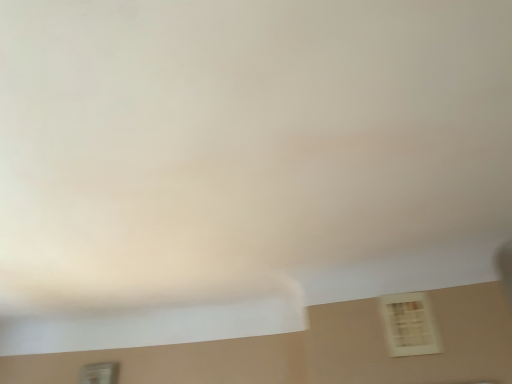
You are a GUI agent. You are given a task and a screenshot of the screen. Output one action in this format:
    pyautogui.click(x=<x>, y=<y>)
    Task: Click on the white plastic window at lower left, the 2th window when ordered from top to bottom
    The height and width of the screenshot is (384, 512).
    Given the screenshot: What is the action you would take?
    pyautogui.click(x=99, y=373)

The height and width of the screenshot is (384, 512). What do you see at coordinates (99, 373) in the screenshot?
I see `white plastic window at lower left, positioned as the first window in bottom-to-top order` at bounding box center [99, 373].

How much space does white matte window at lower right, the second window when ordered from bottom to top, occupy vertically?

The height of white matte window at lower right, the second window when ordered from bottom to top, is 17.20 centimeters.

What do you see at coordinates (409, 324) in the screenshot? I see `white matte window at lower right, acting as the 2th window starting from the left` at bounding box center [409, 324].

Find the location of a particular element. white matte window at lower right, the second window when ordered from bottom to top is located at coordinates (409, 324).

Locate an element on the screen. This screenshot has height=384, width=512. white plastic window at lower left, marked as the 2th window in a right-to-left arrangement is located at coordinates (99, 373).

Which is more to the right, white matte window at lower right, arranged as the first window when viewed from the right, or white plastic window at lower left, the 2th window when ordered from top to bottom?

white matte window at lower right, arranged as the first window when viewed from the right.

Which object is closer to the camera, white matte window at lower right, the first window positioned from the front, or white plastic window at lower left, positioned as the first window in bottom-to-top order?

white matte window at lower right, the first window positioned from the front, is closer to the camera.

Which point is more forward, (x=393, y=301) or (x=115, y=371)?

The point (x=393, y=301) is more forward.

From the image's perspective, which one is positioned lower, white matte window at lower right, acting as the 2th window starting from the left, or white plastic window at lower left, which ranks as the first window in left-to-right order?

From the image's view, white plastic window at lower left, which ranks as the first window in left-to-right order, is below.

From a real-world perspective, between white matte window at lower right, acting as the 2th window starting from the left, and white plastic window at lower left, positioned as the first window in bottom-to-top order, who is vertically lower?

white plastic window at lower left, positioned as the first window in bottom-to-top order, from a real-world perspective.

Considering the relative sizes of white matte window at lower right, the first window positioned from the front, and white plastic window at lower left, which ranks as the first window in back-to-front order, in the image provided, is white matte window at lower right, the first window positioned from the front, wider than white plastic window at lower left, which ranks as the first window in back-to-front order,?

Incorrect, the width of white matte window at lower right, the first window positioned from the front, does not surpass that of white plastic window at lower left, which ranks as the first window in back-to-front order.

From their relative heights in the image, would you say white matte window at lower right, the 2th window positioned from the back, is taller or shorter than white plastic window at lower left, which ranks as the first window in back-to-front order?

Considering their sizes, white matte window at lower right, the 2th window positioned from the back, has less height than white plastic window at lower left, which ranks as the first window in back-to-front order.

Between white matte window at lower right, the second window when ordered from bottom to top, and white plastic window at lower left, which ranks as the first window in back-to-front order, which one has smaller size?

Smaller between the two is white matte window at lower right, the second window when ordered from bottom to top.

Is white matte window at lower right, acting as the 2th window starting from the left, inside the boundaries of white plastic window at lower left, the 2th window when ordered from top to bottom, or outside?

white matte window at lower right, acting as the 2th window starting from the left, is not enclosed by white plastic window at lower left, the 2th window when ordered from top to bottom.

Is white matte window at lower right, the 2th window positioned from the back, directly adjacent to white plastic window at lower left, which is the second window in front-to-back order?

No, white matte window at lower right, the 2th window positioned from the back, is not touching white plastic window at lower left, which is the second window in front-to-back order.

Is white matte window at lower right, the first window positioned from the front, facing away from white plastic window at lower left, the 2th window when ordered from top to bottom?

That's not correct — white matte window at lower right, the first window positioned from the front, is not looking away from white plastic window at lower left, the 2th window when ordered from top to bottom.

Looking at this image, measure the distance between white matte window at lower right, the first window positioned from the front, and white plastic window at lower left, marked as the 2th window in a right-to-left arrangement.

They are 38.79 inches apart.

Locate an element on the screen. window that appears above the white plastic window at lower left, which ranks as the first window in back-to-front order (from the image's perspective) is located at coordinates (409, 324).

Does white plastic window at lower left, the 2th window when ordered from top to bottom, appear on the right side of white matte window at lower right, arranged as the first window when viewed from the right?

No.

Is the depth of white plastic window at lower left, marked as the 2th window in a right-to-left arrangement, greater than that of white matte window at lower right, the second window when ordered from bottom to top?

Yes, it is.

Is point (80, 375) behind point (395, 329)?

Yes, point (80, 375) is farther from viewer.

From the image's perspective, is white plastic window at lower left, which ranks as the first window in back-to-front order, below white matte window at lower right, the 2th window positioned from the back?

Yes, from the image's perspective, white plastic window at lower left, which ranks as the first window in back-to-front order, is below white matte window at lower right, the 2th window positioned from the back.

From the picture: From a real-world perspective, which object rests below the other?

white plastic window at lower left, which is the second window in front-to-back order, from a real-world perspective.

Considering the relative sizes of white plastic window at lower left, marked as the 2th window in a right-to-left arrangement, and white matte window at lower right, the 2th window positioned from the back, in the image provided, is white plastic window at lower left, marked as the 2th window in a right-to-left arrangement, wider than white matte window at lower right, the 2th window positioned from the back,?

Correct, the width of white plastic window at lower left, marked as the 2th window in a right-to-left arrangement, exceeds that of white matte window at lower right, the 2th window positioned from the back.

Which of these two, white plastic window at lower left, which is the second window in front-to-back order, or white matte window at lower right, which ranks as the 1th window in top-to-bottom order, stands taller?

Standing taller between the two is white plastic window at lower left, which is the second window in front-to-back order.

Is white plastic window at lower left, the 2th window when ordered from top to bottom, bigger than white matte window at lower right, the 2th window positioned from the back?

Yes.

Is white matte window at lower right, which ranks as the 1th window in top-to-bottom order, inside white plastic window at lower left, marked as the 2th window in a right-to-left arrangement?

No, white matte window at lower right, which ranks as the 1th window in top-to-bottom order, is not inside white plastic window at lower left, marked as the 2th window in a right-to-left arrangement.

Is there a large distance between white plastic window at lower left, which ranks as the first window in left-to-right order, and white matte window at lower right, acting as the 2th window starting from the left?

That's not correct — white plastic window at lower left, which ranks as the first window in left-to-right order, is a little close to white matte window at lower right, acting as the 2th window starting from the left.

Is white plastic window at lower left, positioned as the first window in bottom-to-top order, oriented towards white matte window at lower right, which ranks as the 1th window in top-to-bottom order?

No, white plastic window at lower left, positioned as the first window in bottom-to-top order, is not facing towards white matte window at lower right, which ranks as the 1th window in top-to-bottom order.

How many degrees apart are the facing directions of white plastic window at lower left, the 2th window when ordered from top to bottom, and white matte window at lower right, acting as the 2th window starting from the left?

The facing directions of white plastic window at lower left, the 2th window when ordered from top to bottom, and white matte window at lower right, acting as the 2th window starting from the left, are 1.92 degrees apart.

This screenshot has height=384, width=512. What are the coordinates of `window above the white plastic window at lower left, which is the second window in front-to-back order (from the image's perspective)` in the screenshot? It's located at (409, 324).

Where is `window that appears on the left of white matte window at lower right, the first window positioned from the front`? window that appears on the left of white matte window at lower right, the first window positioned from the front is located at coordinates (99, 373).

Where is `window that appears below the white matte window at lower right, which ranks as the 1th window in top-to-bottom order (from the image's perspective)`? window that appears below the white matte window at lower right, which ranks as the 1th window in top-to-bottom order (from the image's perspective) is located at coordinates (99, 373).